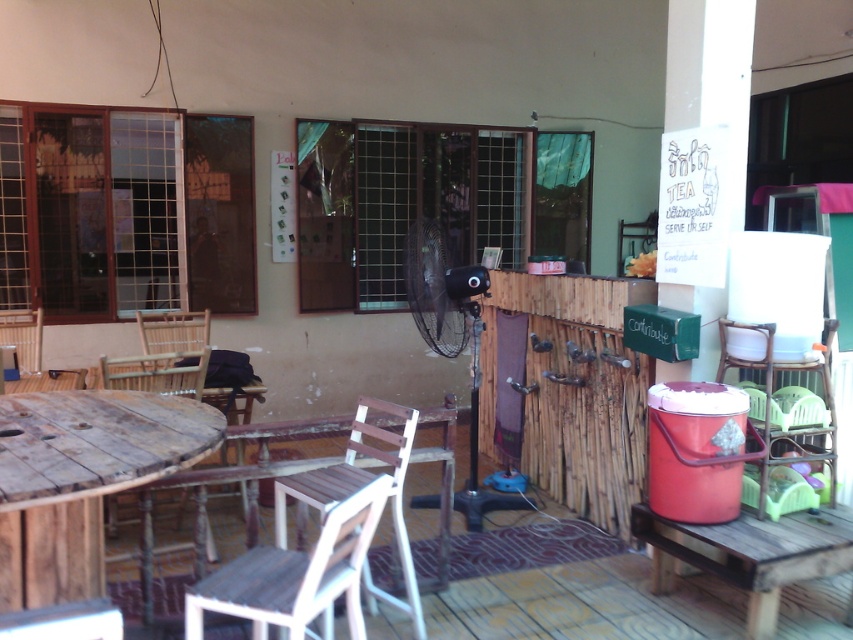
Question: Is white wood chair at lower left positioned at the back of rustic wood table at lower right?

Choices:
 (A) yes
 (B) no

Answer: (B)

Question: Which object is farther from the camera taking this photo?

Choices:
 (A) white wood chair at lower left
 (B) wooden chair at left

Answer: (B)

Question: Can you confirm if wooden chair at lower left is positioned to the right of wooden chair at left?

Choices:
 (A) yes
 (B) no

Answer: (A)

Question: Which point is closer to the camera?

Choices:
 (A) white wood chair at center
 (B) rustic wood table at lower right
 (C) white wood chair at lower left
 (D) wooden chair at lower left

Answer: (C)

Question: Is weathered wood table at lower left further to the viewer compared to white wood chair at center?

Choices:
 (A) no
 (B) yes

Answer: (A)

Question: Which object is the farthest from the rustic wood table at lower right?

Choices:
 (A) weathered wood table at lower left
 (B) white wood chair at lower left

Answer: (A)